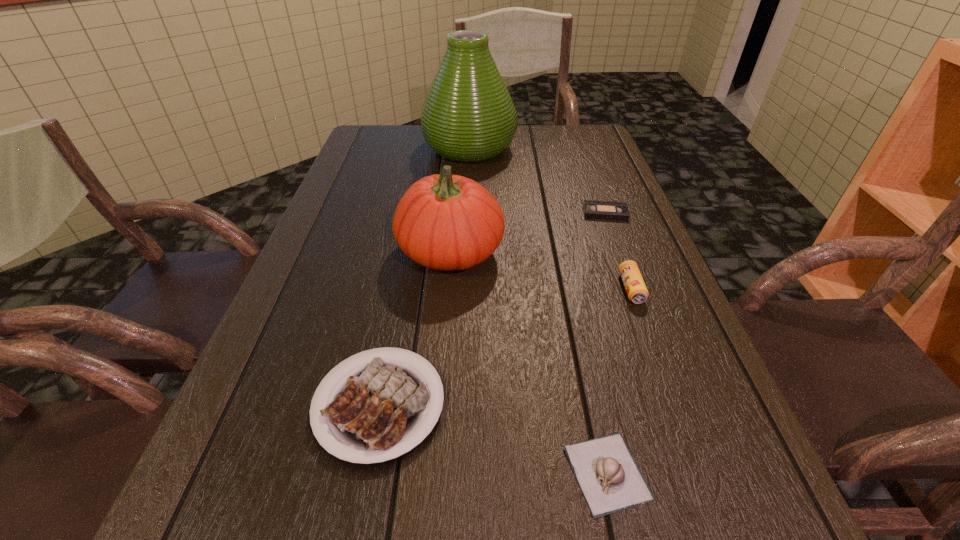
This screenshot has height=540, width=960. Find the location of `free location at the left edge of the desktop`. free location at the left edge of the desktop is located at coordinates (362, 191).

Where is `free space at the right edge`? free space at the right edge is located at coordinates (578, 174).

Where is `free point at the far left corner`? The width and height of the screenshot is (960, 540). free point at the far left corner is located at coordinates (376, 150).

You are a GUI agent. You are given a task and a screenshot of the screen. Output one action in this format:
    pyautogui.click(x=<x>, y=<y>)
    Task: Click on the blank space at the far right corner of the desktop
    The height and width of the screenshot is (540, 960).
    Given the screenshot: What is the action you would take?
    pyautogui.click(x=590, y=129)

Find the location of a particular element. empty space between the shortest object and the garlic is located at coordinates (606, 342).

The height and width of the screenshot is (540, 960). In order to click on vacant space that's between the third object from right to left and the plate in this screenshot , I will do `click(493, 438)`.

At what (x,y) coordinates should I click in order to perform the action: click on blank region between the plate and the shortest object. Please return your answer as a coordinate pair (x, y). This screenshot has height=540, width=960. Looking at the image, I should click on pyautogui.click(x=492, y=308).

Locate an element on the screen. Image resolution: width=960 pixels, height=540 pixels. empty space between the beer can and the garlic is located at coordinates (619, 381).

The height and width of the screenshot is (540, 960). I want to click on free point between the beer can and the shortest object, so click(x=618, y=251).

This screenshot has height=540, width=960. Find the location of `free space between the second shortest object and the shortest object`. free space between the second shortest object and the shortest object is located at coordinates (606, 342).